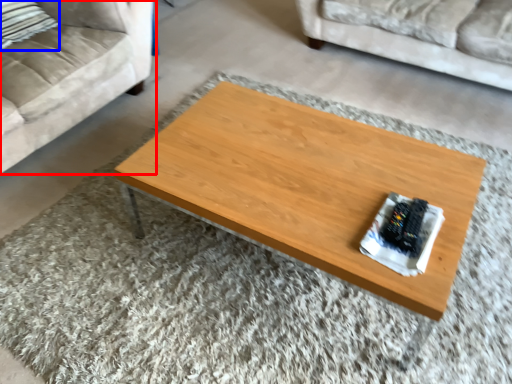
Question: Among these objects, which one is nearest to the camera, studio couch (highlighted by a red box) or pillow (highlighted by a blue box)?

Choices:
 (A) studio couch
 (B) pillow

Answer: (A)